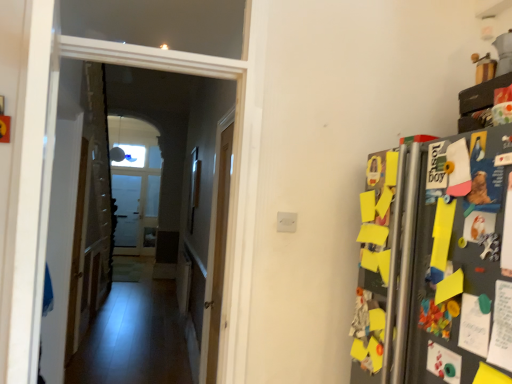
Question: Is smooth wooden floor at center thinner than light wood door at center?

Choices:
 (A) no
 (B) yes

Answer: (B)

Question: Is smooth wooden floor at center with light wood door at center?

Choices:
 (A) no
 (B) yes

Answer: (A)

Question: Is smooth wooden floor at center not near light wood door at center?

Choices:
 (A) yes
 (B) no

Answer: (A)

Question: Considering the relative sizes of smooth wooden floor at center and light wood door at center in the image provided, is smooth wooden floor at center bigger than light wood door at center?

Choices:
 (A) no
 (B) yes

Answer: (A)

Question: Considering the relative sizes of smooth wooden floor at center and light wood door at center in the image provided, is smooth wooden floor at center taller than light wood door at center?

Choices:
 (A) no
 (B) yes

Answer: (A)

Question: Is smooth wooden floor at center outside of light wood door at center?

Choices:
 (A) no
 (B) yes

Answer: (B)

Question: From a real-world perspective, is light wood door at center under smooth wooden floor at center?

Choices:
 (A) yes
 (B) no

Answer: (A)

Question: From the image's perspective, would you say light wood door at center is shown under smooth wooden floor at center?

Choices:
 (A) no
 (B) yes

Answer: (B)

Question: Is light wood door at center to the right of smooth wooden floor at center from the viewer's perspective?

Choices:
 (A) yes
 (B) no

Answer: (A)

Question: Is light wood door at center facing away from smooth wooden floor at center?

Choices:
 (A) yes
 (B) no

Answer: (B)

Question: Considering the relative sizes of light wood door at center and smooth wooden floor at center in the image provided, is light wood door at center taller than smooth wooden floor at center?

Choices:
 (A) no
 (B) yes

Answer: (B)

Question: Is light wood door at center at the left side of smooth wooden floor at center?

Choices:
 (A) yes
 (B) no

Answer: (B)

Question: From the image's perspective, is light wood door at center positioned above or below smooth wooden floor at center?

Choices:
 (A) above
 (B) below

Answer: (B)